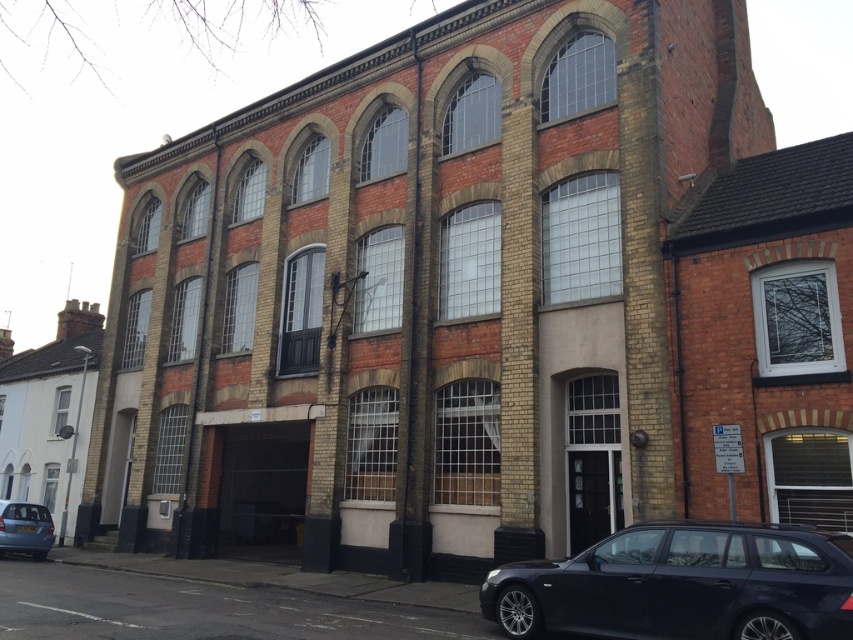
Based on the photo, you are standing at a point 8.37 meters away from the point marked as point [757,561] on the building. If you want to take a photo of the building from this position, will you be able to capture the entire building in one shot?

The distance between you and point [757,561] is 8.37 meters. However, without knowing the camera angle or lens type, it is impossible to determine if the entire building can be captured in one shot.

You are a parking attendant who needs to fit a new vehicle into the space between the matte black car at lower right and the matte blue hatchback at lower left. The new vehicle is 1.8 meters tall. Can it fit without touching the cars?

The matte black car at lower right is taller than the matte blue hatchback at lower left. Since the new vehicle is 1.8 meters tall, it depends on the height of the taller car. If the matte black car is taller than 1.8 meters, then the new vehicle can fit as it is shorter. If the matte black car is shorter than 1.8 meters, it might not fit. However, the description only states the matte black car is taller than the blue one, but doesn